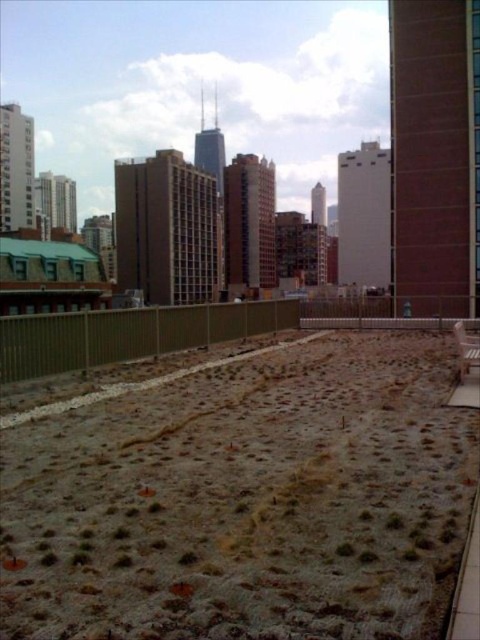
You are a visitor at the rooftop garden and want to sit down. There is a wooden park bench at center and a green fuzzy plant at center. Which object can you sit on?

The wooden park bench at center is larger in size than the green fuzzy plant at center, so you can sit on the wooden park bench at center.

You are a gardener who wants to place a new decorative pot between the wooden park bench at center and the green fuzzy plant at center. Based on their widths, which object should you place the pot closer to to ensure it fits within the available space?

The wooden park bench at center might be wider than the green fuzzy plant at center, so placing the pot closer to the green fuzzy plant at center would leave more space for the bench.

You are a visitor sitting on the rooftop and want to move from the wooden park bench at center to the green fuzzy plant at center. Which direction should you move to reach it?

The wooden park bench at center is to the right of the green fuzzy plant at center, so you should move to the left to reach it.